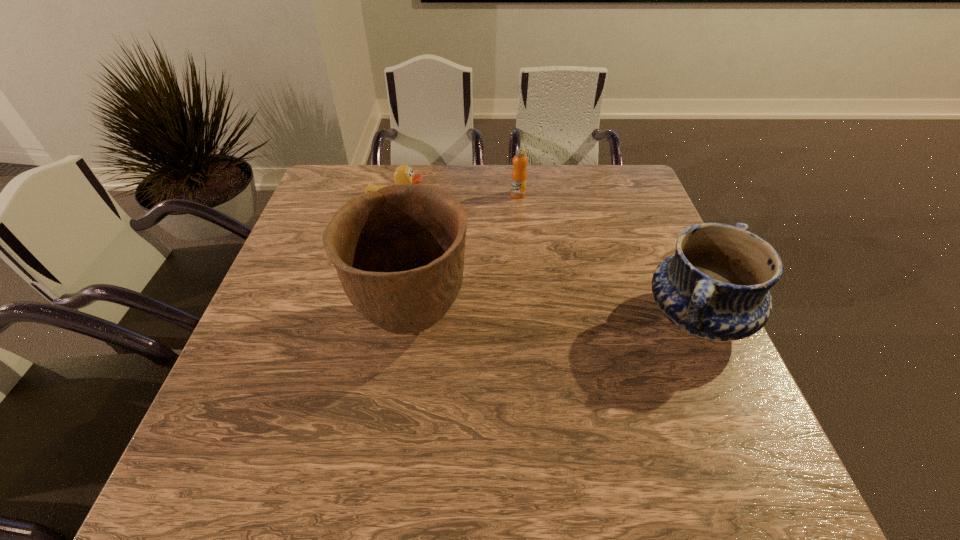
Locate an element on the screen. the taller pottery is located at coordinates (398, 251).

Find the location of a particular element. Image resolution: width=960 pixels, height=540 pixels. the tallest object is located at coordinates (398, 251).

The image size is (960, 540). In order to click on the third shortest object in this screenshot , I will do `click(716, 286)`.

Identify the location of the right pottery. (716, 286).

I want to click on the third object from left to right, so click(519, 173).

Locate an element on the screen. orange juice is located at coordinates (519, 173).

The height and width of the screenshot is (540, 960). Identify the location of duck. (403, 174).

You are a GUI agent. You are given a task and a screenshot of the screen. Output one action in this format:
    pyautogui.click(x=<x>, y=<y>)
    Task: Click on the free region located 0.380m on the back of the taller pottery
    The image size is (960, 540).
    Given the screenshot: What is the action you would take?
    pyautogui.click(x=430, y=192)

Identify the location of vacant space located 0.120m on the left of the right pottery. Image resolution: width=960 pixels, height=540 pixels. (591, 318).

Find the location of `vacant space situated 0.050m on the front label of the orange juice`. vacant space situated 0.050m on the front label of the orange juice is located at coordinates [x=519, y=209].